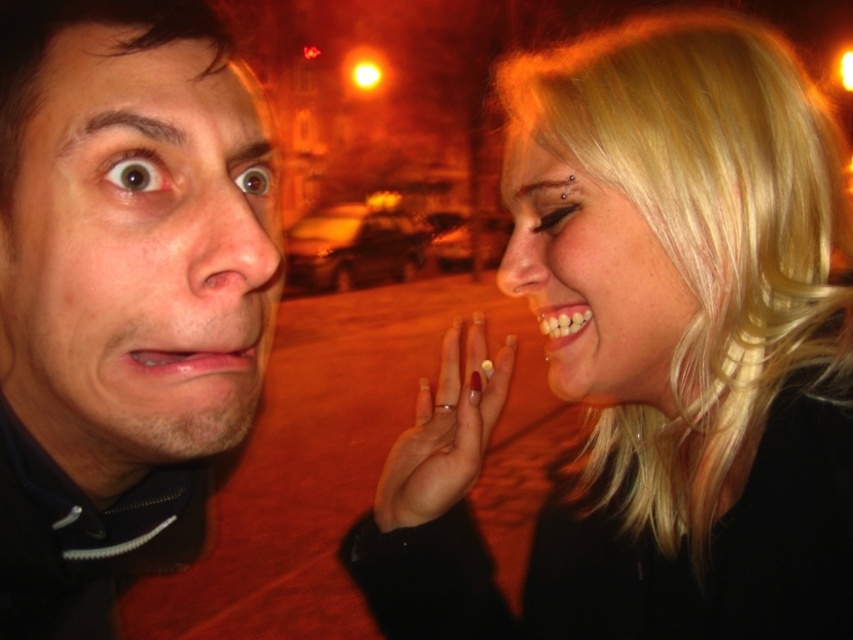
Can you confirm if smooth skin face at left is positioned to the left of matte skin nose at center?

Indeed, smooth skin face at left is positioned on the left side of matte skin nose at center.

Is point (28, 426) positioned behind point (202, 216)?

That is True.

Where is `smooth skin face at left`? smooth skin face at left is located at coordinates (137, 252).

Between white matte ring at center and smooth skin nose at center, which one is positioned lower?

white matte ring at center is below.

Is point (413, 483) farther from viewer compared to point (515, 225)?

Yes, point (413, 483) is behind point (515, 225).

Measure the distance between point (x=444, y=461) and camera.

Point (x=444, y=461) and camera are 25.24 inches apart from each other.

Locate an element on the screen. The height and width of the screenshot is (640, 853). white matte ring at center is located at coordinates (444, 433).

Is blonde hair at upper right wider than matte skin nose at center?

Yes.

Which is behind, point (793, 106) or point (207, 292)?

The point (793, 106) is more distant.

This screenshot has width=853, height=640. What do you see at coordinates (653, 356) in the screenshot? I see `blonde hair at upper right` at bounding box center [653, 356].

Locate an element on the screen. blonde hair at upper right is located at coordinates (653, 356).